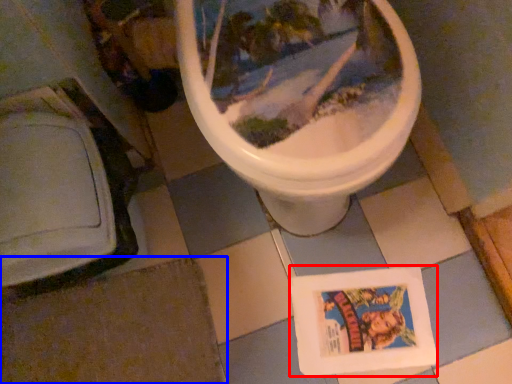
Question: Which point is closer to the camera, comic book (highlighted by a red box) or tile (highlighted by a blue box)?

Choices:
 (A) comic book
 (B) tile

Answer: (B)